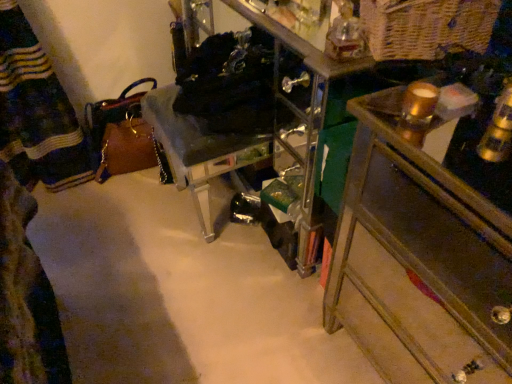
The height and width of the screenshot is (384, 512). What do you see at coordinates (426, 27) in the screenshot?
I see `woven natural basket at upper right` at bounding box center [426, 27].

Measure the distance between point (x=431, y=83) and camera.

Point (x=431, y=83) and camera are 32.72 inches apart.

Locate an element on the screen. This screenshot has width=512, height=384. black fabric laundry at center is located at coordinates (230, 83).

From the image's perspective, which one is positioned higher, wooden chest of drawers at right or clear acrylic chair at center?

clear acrylic chair at center, from the image's perspective.

Which object is thinner, wooden chest of drawers at right or clear acrylic chair at center?

Thinner between the two is clear acrylic chair at center.

In the scene shown: Does wooden chest of drawers at right appear on the right side of clear acrylic chair at center?

Indeed, wooden chest of drawers at right is positioned on the right side of clear acrylic chair at center.

Is wooden chest of drawers at right outside of clear acrylic chair at center?

wooden chest of drawers at right lies outside clear acrylic chair at center's area.

Who is shorter, black fabric laundry at center or wooden chest of drawers at right?

Standing shorter between the two is black fabric laundry at center.

Is black fabric laundry at center with wooden chest of drawers at right?

No, black fabric laundry at center is not making contact with wooden chest of drawers at right.

What's the angular difference between black fabric laundry at center and wooden chest of drawers at right's facing directions?

The facing directions of black fabric laundry at center and wooden chest of drawers at right are 0.00168 degrees apart.

Is gold metallic candle at upper right to the left or to the right of clear acrylic chair at center in the image?

gold metallic candle at upper right is to the right of clear acrylic chair at center.

Who is more distant, gold metallic candle at upper right or clear acrylic chair at center?

clear acrylic chair at center is further from the camera.

Between gold metallic candle at upper right and clear acrylic chair at center, which one has smaller width?

gold metallic candle at upper right.

Locate an element on the screen. furniture behind the gold metallic candle at upper right is located at coordinates (198, 150).

Can you confirm if woven natural basket at upper right is thinner than wooden chest of drawers at right?

Yes, woven natural basket at upper right is thinner than wooden chest of drawers at right.

Does woven natural basket at upper right turn towards wooden chest of drawers at right?

No, woven natural basket at upper right does not turn towards wooden chest of drawers at right.

Is woven natural basket at upper right positioned beyond the bounds of wooden chest of drawers at right?

woven natural basket at upper right is positioned outside wooden chest of drawers at right.

Considering the sizes of objects woven natural basket at upper right and wooden chest of drawers at right in the image provided, who is shorter, woven natural basket at upper right or wooden chest of drawers at right?

With less height is woven natural basket at upper right.

Identify the location of beverage in front of the woven natural basket at upper right. This screenshot has height=384, width=512. (419, 102).

Which is more to the right, gold metallic candle at upper right or woven natural basket at upper right?

Positioned to the right is woven natural basket at upper right.

From a real-world perspective, which is physically below, gold metallic candle at upper right or woven natural basket at upper right?

gold metallic candle at upper right, from a real-world perspective.

Does gold metallic candle at upper right turn towards woven natural basket at upper right?

No, gold metallic candle at upper right is not aimed at woven natural basket at upper right.

Is gold metallic candle at upper right oriented towards black fabric laundry at center?

No, gold metallic candle at upper right is not oriented towards black fabric laundry at center.

Is black fabric laundry at center located within gold metallic candle at upper right?

No, gold metallic candle at upper right does not contain black fabric laundry at center.

Considering the positions of objects gold metallic candle at upper right and black fabric laundry at center in the image provided, who is more to the left, gold metallic candle at upper right or black fabric laundry at center?

From the viewer's perspective, black fabric laundry at center appears more on the left side.

Is wooden chest of drawers at right beside black fabric laundry at center?

wooden chest of drawers at right and black fabric laundry at center are clearly separated.

Considering the positions of points (469, 374) and (181, 113), is point (469, 374) farther from camera compared to point (181, 113)?

No.

From the image's perspective, does wooden chest of drawers at right appear higher than black fabric laundry at center?

No, from the image's perspective, wooden chest of drawers at right is not on top of black fabric laundry at center.

Find the location of a particular element. This screenshot has width=512, height=384. the chest of drawers located above the clear acrylic chair at center (from a real-world perspective) is located at coordinates (426, 245).

Identify the location of laundry behind the wooden chest of drawers at right. (230, 83).

Estimate the real-world distances between objects in this image. Which object is further from black fabric laundry at center, clear acrylic chair at center or gold metallic candle at upper right?

The object further to black fabric laundry at center is gold metallic candle at upper right.

Estimate the real-world distances between objects in this image. Which object is further from wooden chest of drawers at right, gold metallic candle at upper right or black fabric laundry at center?

black fabric laundry at center lies further to wooden chest of drawers at right than the other object.

Estimate the real-world distances between objects in this image. Which object is further from clear acrylic chair at center, black fabric laundry at center or wooden chest of drawers at right?

wooden chest of drawers at right.

Estimate the real-world distances between objects in this image. Which object is closer to clear acrylic chair at center, gold metallic candle at upper right or wooden chest of drawers at right?

wooden chest of drawers at right lies closer to clear acrylic chair at center than the other object.

Consider the image. From the image, which object appears to be nearer to gold metallic candle at upper right, clear acrylic chair at center or wooden chest of drawers at right?

wooden chest of drawers at right lies closer to gold metallic candle at upper right than the other object.

Based on their spatial positions, is clear acrylic chair at center or gold metallic candle at upper right closer to wooden chest of drawers at right?

gold metallic candle at upper right lies closer to wooden chest of drawers at right than the other object.

Estimate the real-world distances between objects in this image. Which object is further from wooden chest of drawers at right, woven natural basket at upper right or black fabric laundry at center?

black fabric laundry at center is further to wooden chest of drawers at right.

Looking at the image, which one is located further to woven natural basket at upper right, gold metallic candle at upper right or black fabric laundry at center?

Based on the image, black fabric laundry at center appears to be further to woven natural basket at upper right.

Identify the location of beverage located between clear acrylic chair at center and woven natural basket at upper right in the left-right direction. pyautogui.click(x=419, y=102).

The height and width of the screenshot is (384, 512). In order to click on laundry between clear acrylic chair at center and woven natural basket at upper right in this screenshot , I will do click(x=230, y=83).

Locate an element on the screen. This screenshot has width=512, height=384. laundry situated between clear acrylic chair at center and gold metallic candle at upper right from left to right is located at coordinates (230, 83).

Locate an element on the screen. Image resolution: width=512 pixels, height=384 pixels. beverage between wooden chest of drawers at right and clear acrylic chair at center along the z-axis is located at coordinates (419, 102).